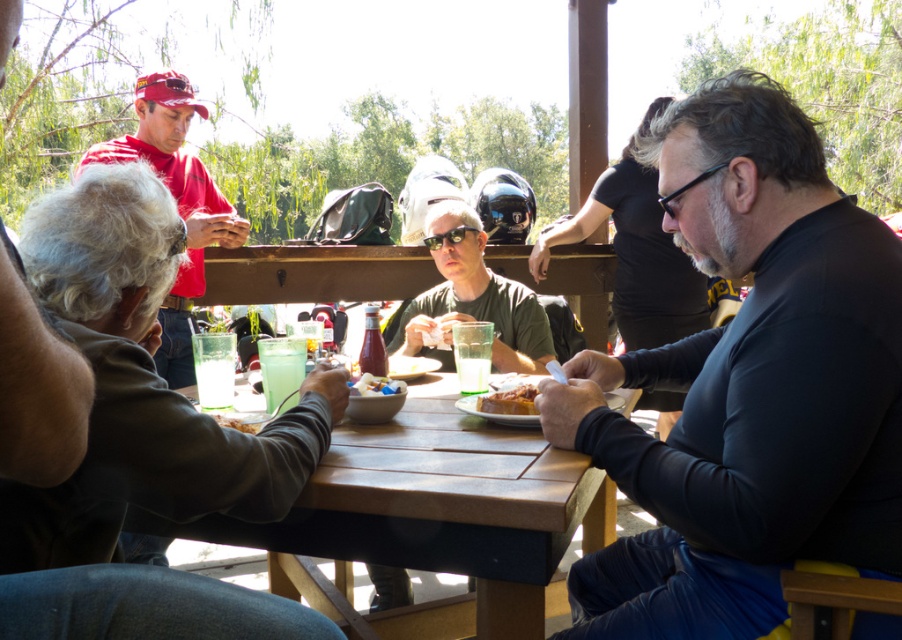
Question: Is wooden table at center further to camera compared to smooth plastic bowl at center?

Choices:
 (A) no
 (B) yes

Answer: (A)

Question: Is dark blue long-sleeve shirt at right smaller than red matte cap at upper left?

Choices:
 (A) no
 (B) yes

Answer: (A)

Question: Is dark blue long-sleeve shirt at right to the right of black plastic goggles at center from the viewer's perspective?

Choices:
 (A) no
 (B) yes

Answer: (B)

Question: Which is farther from the dark blue long-sleeve shirt at right?

Choices:
 (A) matte red shirt at upper left
 (B) wooden table at center
 (C) red matte cap at upper left

Answer: (B)

Question: Among these objects, which one is nearest to the camera?

Choices:
 (A) brown crumbly bread at lower left
 (B) dark blue long-sleeve shirt at right
 (C) black matte shirt at center
 (D) smooth plastic bowl at center

Answer: (C)

Question: Which point is farther to the camera?

Choices:
 (A) brown crumbly bread at lower left
 (B) matte red shirt at upper left
 (C) black plastic goggles at center
 (D) black matte shirt at center

Answer: (B)